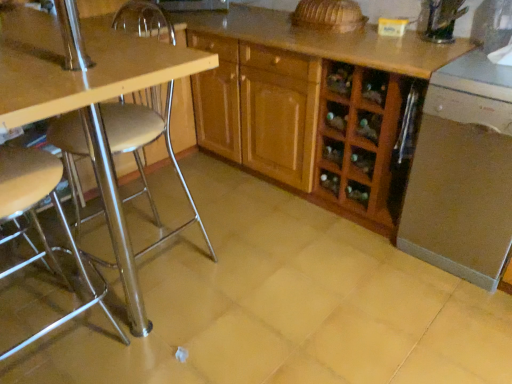
Where is `free location to the left of wooden table at left`? This screenshot has width=512, height=384. free location to the left of wooden table at left is located at coordinates (57, 258).